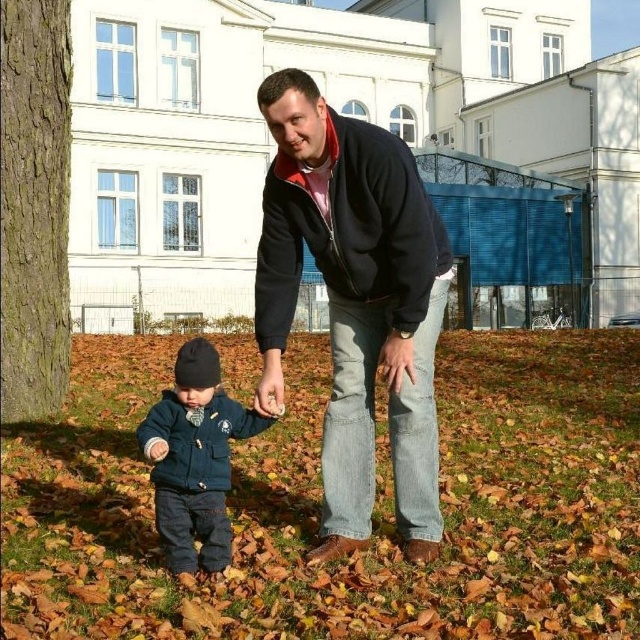
Question: Can you confirm if matte black jacket at center is positioned to the left of dark blue fleece jacket at lower left?

Choices:
 (A) no
 (B) yes

Answer: (A)

Question: Which point is closer to the camera?

Choices:
 (A) dark blue fleece jacket at lower left
 (B) matte black jacket at center
 (C) dark blue fleece sweatshirt at center

Answer: (A)

Question: Which point is farther from the camera taking this photo?

Choices:
 (A) pyautogui.click(x=396, y=259)
 (B) pyautogui.click(x=208, y=536)
 (C) pyautogui.click(x=390, y=314)

Answer: (C)

Question: Can you confirm if dark blue fleece sweatshirt at center is bigger than dark blue fleece jacket at lower left?

Choices:
 (A) no
 (B) yes

Answer: (A)

Question: Which object is closer to the camera taking this photo?

Choices:
 (A) matte black jacket at center
 (B) dark blue fleece sweatshirt at center
 (C) dark blue fleece jacket at lower left

Answer: (C)

Question: Is matte black jacket at center in front of dark blue fleece jacket at lower left?

Choices:
 (A) yes
 (B) no

Answer: (B)